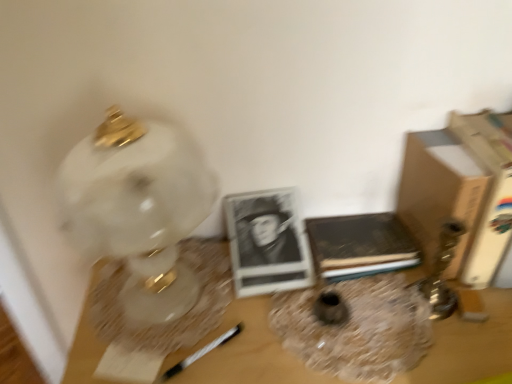
You are a GUI agent. You are given a task and a screenshot of the screen. Output one action in this format:
    pyautogui.click(x=<x>, y=<y>)
    Task: Click on the free space to the right of matte glass vase at center, which ranks as the 1th vase in left-to-right order
    The width and height of the screenshot is (512, 384).
    Given the screenshot: What is the action you would take?
    pyautogui.click(x=415, y=314)